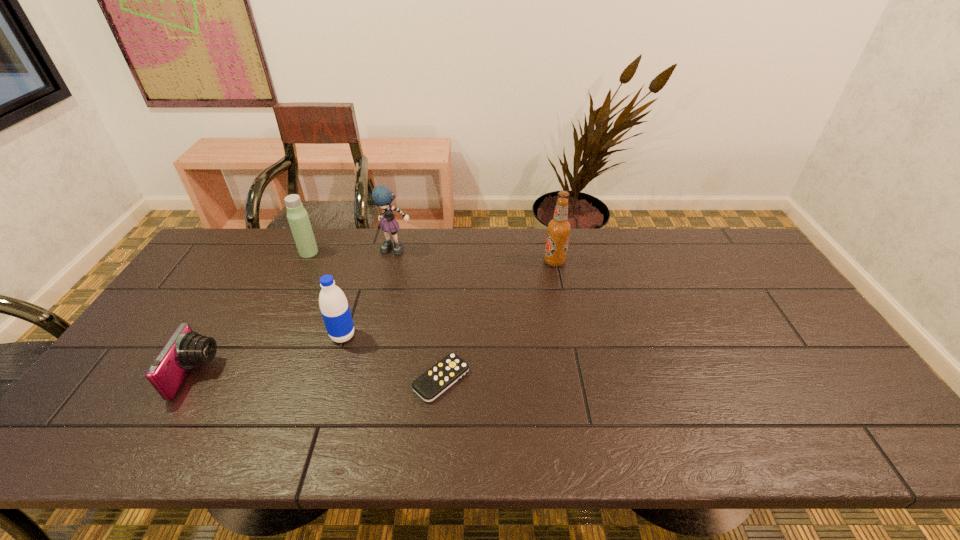
Where is `the rightmost object`? the rightmost object is located at coordinates (558, 229).

This screenshot has width=960, height=540. Find the location of `rag doll`. rag doll is located at coordinates (382, 196).

Where is `thermos bottle`? thermos bottle is located at coordinates coord(297,216).

Locate an element on the screen. This screenshot has width=960, height=540. the fourth object from right to left is located at coordinates (335, 310).

Locate an element on the screen. water bottle is located at coordinates (335, 310).

I want to click on the leftmost object, so (185, 349).

This screenshot has height=540, width=960. Find the location of `camera`. camera is located at coordinates (185, 349).

Where is `remote control`? The image size is (960, 540). remote control is located at coordinates (431, 384).

Image resolution: width=960 pixels, height=540 pixels. Find the location of `the fifth object from left to right`. the fifth object from left to right is located at coordinates (431, 384).

The image size is (960, 540). I want to click on vacant area situated on the front label of the beer bottle, so click(x=446, y=261).